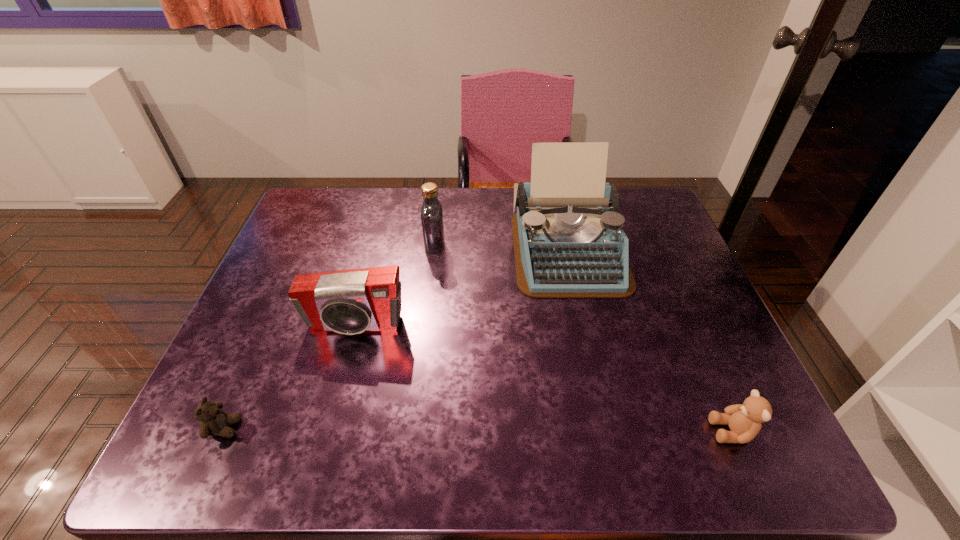
Locate an element on the screen. the tallest object is located at coordinates (568, 240).

The width and height of the screenshot is (960, 540). I want to click on the second object from right to left, so click(x=568, y=240).

Locate an element on the screen. the second tallest object is located at coordinates (432, 223).

Image resolution: width=960 pixels, height=540 pixels. Find the location of `the third object from left to right`. the third object from left to right is located at coordinates (432, 223).

This screenshot has width=960, height=540. I want to click on the second object from left to right, so click(349, 302).

This screenshot has width=960, height=540. I want to click on the third nearest object, so click(x=349, y=302).

Where is `the fourth tallest object`? This screenshot has height=540, width=960. the fourth tallest object is located at coordinates (744, 420).

You are a GUI agent. You are given a task and a screenshot of the screen. Output one action in this format:
    pyautogui.click(x=<x>, y=<y>)
    Task: Click on the rightmost object
    
    Given the screenshot: What is the action you would take?
    pyautogui.click(x=744, y=420)

The image size is (960, 540). I want to click on the shortest object, so click(x=214, y=421).

I want to click on the leftmost object, so click(x=214, y=421).